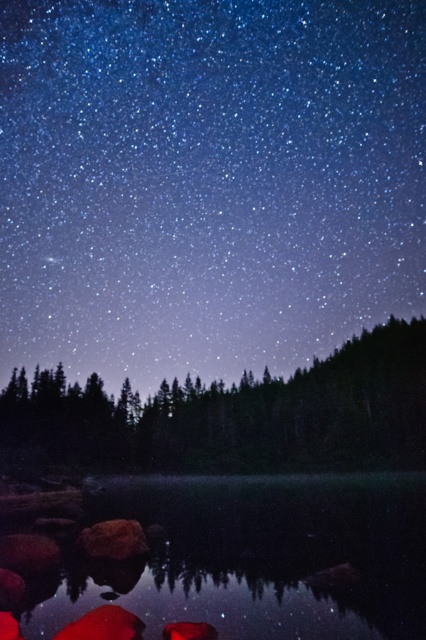
You are standing at the origin point in the image and want to locate the transparent water at center. Which direction should you move to reach it?

The transparent water at center is located at point (253, 557), so you should move northeast to reach it.

You are an astronomer observing the night sky from a boat on the transparent water at center. You notice the dark green textured trees at center in the distance. Which object is closer to the horizon?

The dark green textured trees at center are closer to the horizon than the transparent water at center because the trees are taller and appear further away, making them seem lower on the horizon compared to the water which is at eye level.